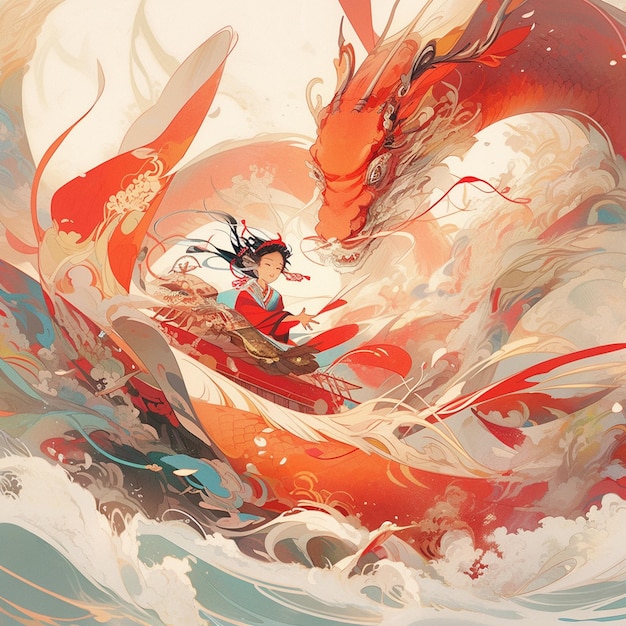
Image resolution: width=626 pixels, height=626 pixels. I want to click on artwork, so click(x=332, y=344).